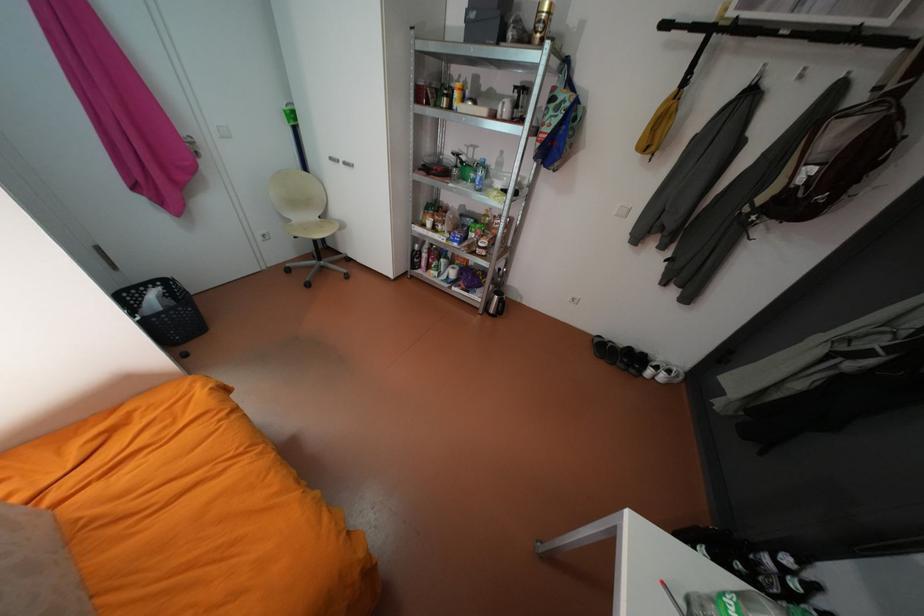
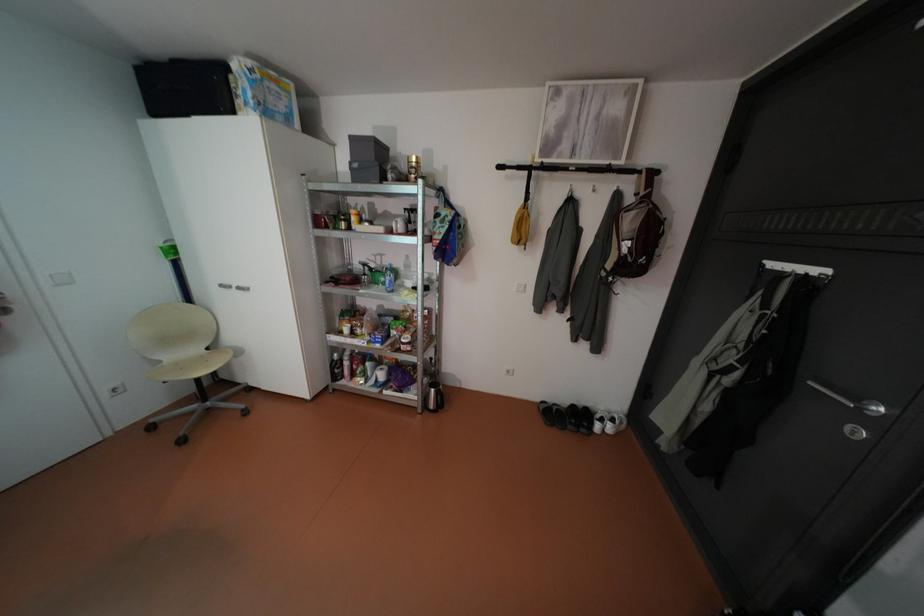
Find the pixel in the second image that matches point (299, 220) in the first image.

(168, 361)